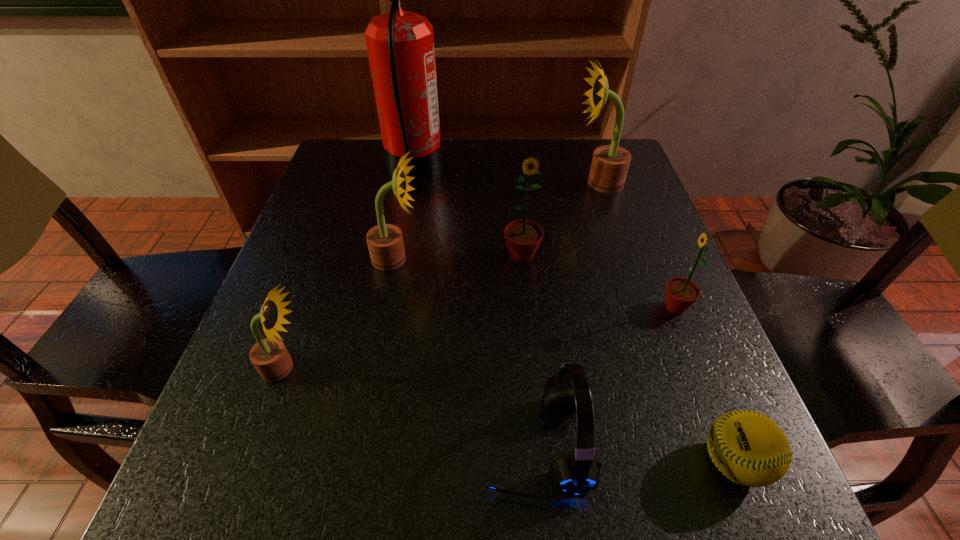
Locate an element on the screen. This screenshot has height=540, width=960. free space located on the face of the third sunflower from left to right is located at coordinates (536, 406).

Find the location of a particular element. The width and height of the screenshot is (960, 540). free space located on the face of the leftmost object is located at coordinates (415, 368).

Locate an element on the screen. Image resolution: width=960 pixels, height=540 pixels. vacant space located 0.250m on the face of the fourth farthest sunflower is located at coordinates (526, 307).

Find the location of a particular element. blank space located on the face of the fourth farthest sunflower is located at coordinates (516, 307).

Where is `blank space located on the face of the fourth farthest sunflower`? blank space located on the face of the fourth farthest sunflower is located at coordinates click(x=467, y=307).

At what (x,y) coordinates should I click in order to perform the action: click on vacant space positioned on the ear cushions of the second shortest object. Please return your answer as a coordinate pair (x, y). The image size is (960, 540). Looking at the image, I should click on (225, 444).

The image size is (960, 540). I want to click on free space located 0.370m on the ear cushions of the second shortest object, so point(231,444).

Identify the location of vacant space located 0.110m on the ear cushions of the second shortest object. (409, 444).

You are a GUI agent. You are given a task and a screenshot of the screen. Output one action in this format:
    pyautogui.click(x=<x>, y=<y>)
    Task: Click on the free region located on the logo side of the softball
    Image resolution: width=960 pixels, height=540 pixels.
    Given the screenshot: What is the action you would take?
    pyautogui.click(x=650, y=462)

Locate an element on the screen. The width and height of the screenshot is (960, 540). vacant space located on the logo side of the softball is located at coordinates (531, 462).